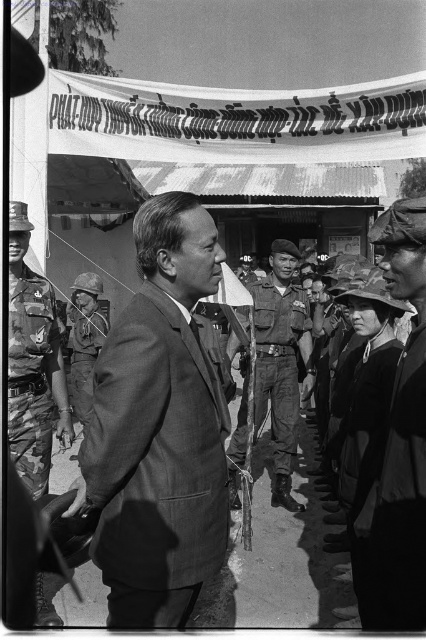
Question: Which object appears farthest from the camera in this image?

Choices:
 (A) smooth suit at center
 (B) uniformed soldier at center
 (C) camo uniform at left
 (D) dark gray uniform at center

Answer: (B)

Question: Is camo uniform at left positioned at the back of uniformed soldier at center?

Choices:
 (A) yes
 (B) no

Answer: (B)

Question: Which point appears closest to the camera in this image?

Choices:
 (A) (46, 280)
 (B) (88, 312)

Answer: (A)

Question: Is dark gray uniform at center to the right of uniformed soldier at center from the viewer's perspective?

Choices:
 (A) no
 (B) yes

Answer: (B)

Question: In this image, where is smooth suit at center located relative to camouflage fabric helmet at center?

Choices:
 (A) right
 (B) left

Answer: (A)

Question: Based on their relative distances, which object is nearer to the uniformed soldier at center?

Choices:
 (A) camouflage fabric helmet at center
 (B) dark gray uniform at center

Answer: (A)